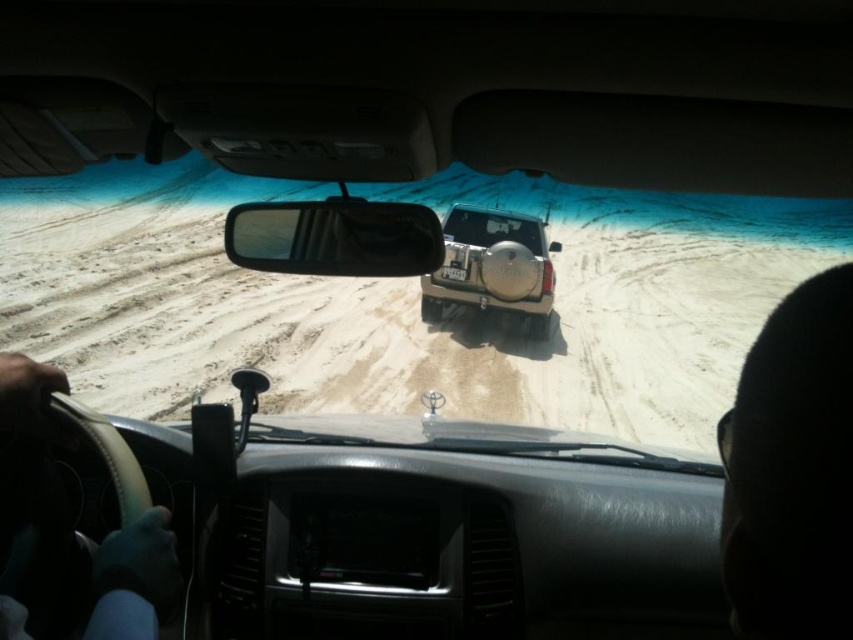
Question: Which object appears closest to the camera in this image?

Choices:
 (A) clear glass windshield at center
 (B) black leather steering wheel at lower left

Answer: (B)

Question: Can you confirm if black leather steering wheel at lower left is positioned above black plastic license plate at rear?

Choices:
 (A) no
 (B) yes

Answer: (A)

Question: Which of the following is the farthest from the observer?

Choices:
 (A) white sandy dirt track at center
 (B) black hair at upper right
 (C) clear glass windshield at center
 (D) black leather steering wheel at lower left

Answer: (C)

Question: From the image, what is the correct spatial relationship of clear glass windshield at center in relation to black plastic license plate at rear?

Choices:
 (A) left
 (B) right

Answer: (B)

Question: Does clear plastic windshield at center have a smaller size compared to black plastic license plate at rear?

Choices:
 (A) yes
 (B) no

Answer: (B)

Question: Which point is farther to the camera?

Choices:
 (A) (815, 337)
 (B) (294, 340)

Answer: (B)